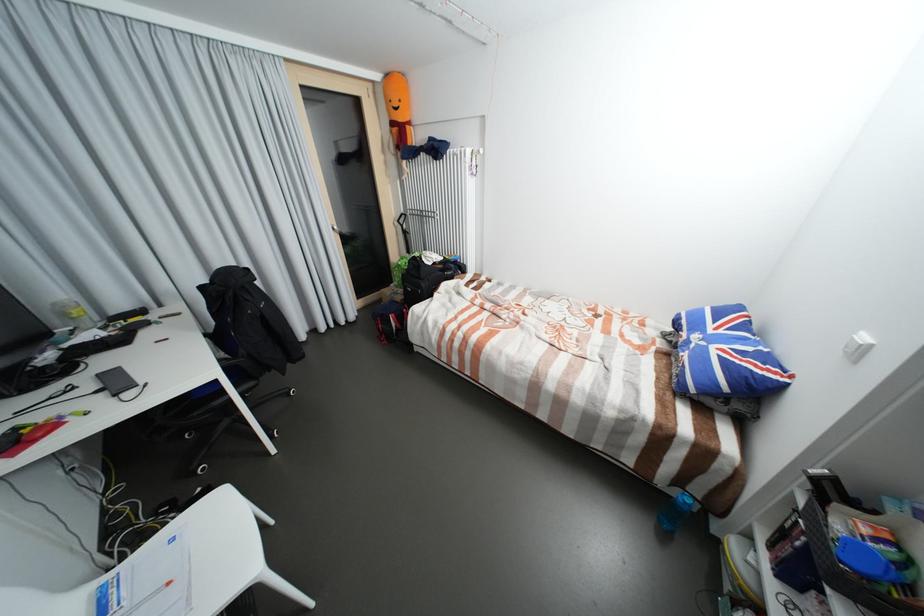
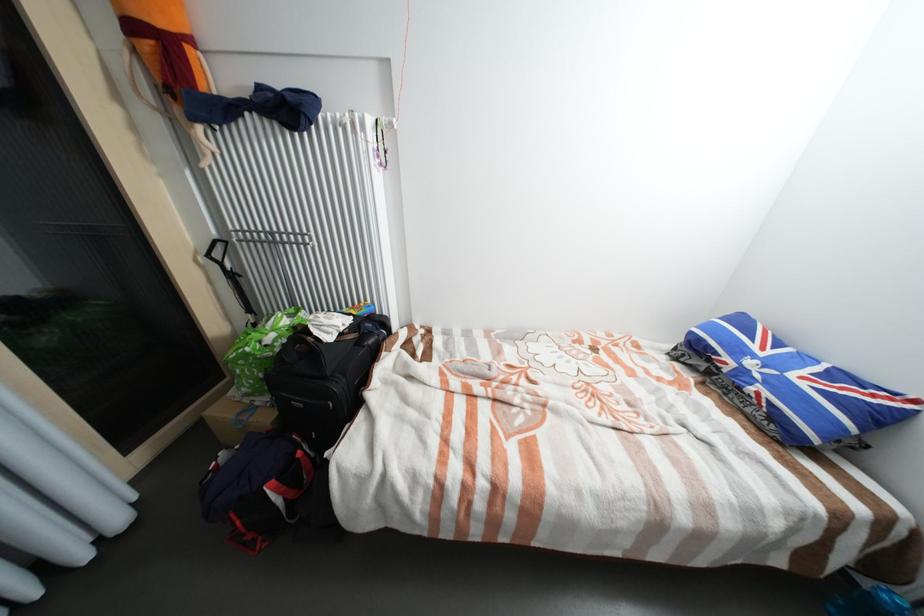
Find the pixel in the second image that matches (718,331) in the first image.

(769, 354)